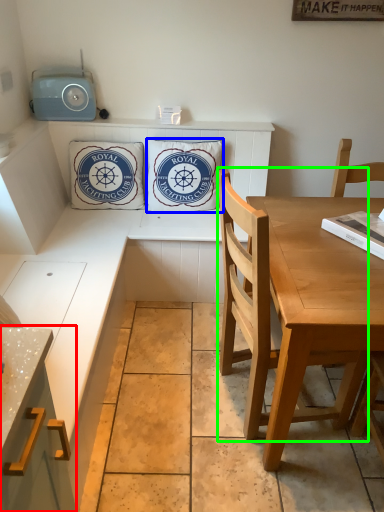
Question: Considering the real-world distances, which object is farthest from cabinetry (highlighted by a red box)? pillow (highlighted by a blue box) or chair (highlighted by a green box)?

Choices:
 (A) pillow
 (B) chair

Answer: (A)